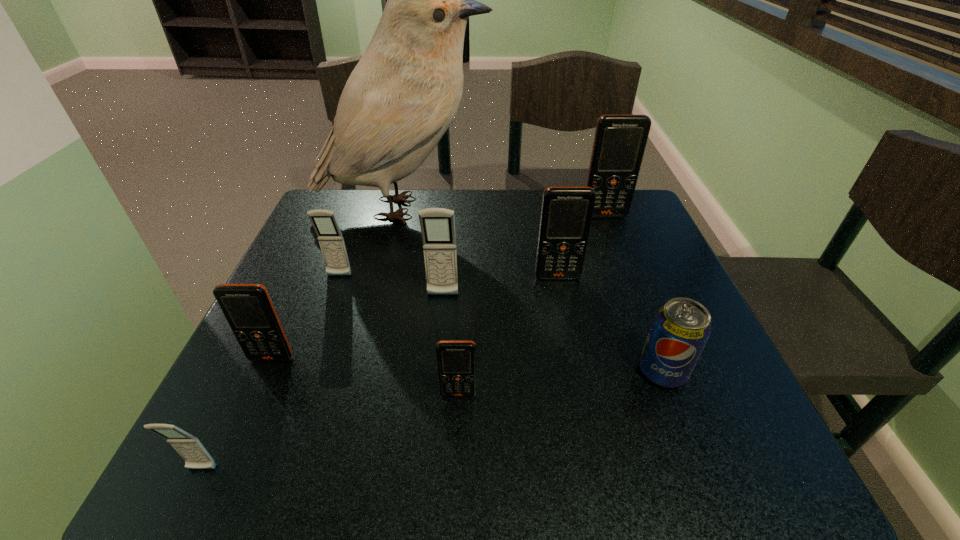
The width and height of the screenshot is (960, 540). In order to click on free space at the near right corner of the desktop in this screenshot , I will do `click(723, 458)`.

The width and height of the screenshot is (960, 540). What are the coordinates of `vacant region between the farthest gray cellular telephone and the soda` in the screenshot? It's located at (501, 323).

I want to click on free spot between the second orange cellular telephone from right to left and the second farthest gray cellular telephone, so point(500,286).

The height and width of the screenshot is (540, 960). I want to click on vacant point located between the soda and the tallest object, so click(x=532, y=289).

Locate an element on the screen. The image size is (960, 540). vacant area that lies between the nearest cellular telephone and the soda is located at coordinates (432, 420).

Identify the location of unoccupied position between the tallest object and the second farthest orange cellular telephone. (480, 242).

At what (x,y) coordinates should I click in order to perform the action: click on empty location between the fifth nearest object and the second biggest orange cellular telephone. Please return your answer as a coordinate pair (x, y). Looking at the image, I should click on (500, 286).

Where is `vacant space that's between the nearest cellular telephone and the biggest gray cellular telephone`? The width and height of the screenshot is (960, 540). vacant space that's between the nearest cellular telephone and the biggest gray cellular telephone is located at coordinates (323, 382).

This screenshot has width=960, height=540. I want to click on the sixth closest object relative to the soda, so click(x=330, y=238).

You are a GUI agent. You are given a task and a screenshot of the screen. Output one action in this format:
    pyautogui.click(x=<x>, y=<y>)
    Task: Click on the object that stands as the closest to the smallest gray cellular telephone
    The height and width of the screenshot is (540, 960).
    Given the screenshot: What is the action you would take?
    pyautogui.click(x=248, y=309)